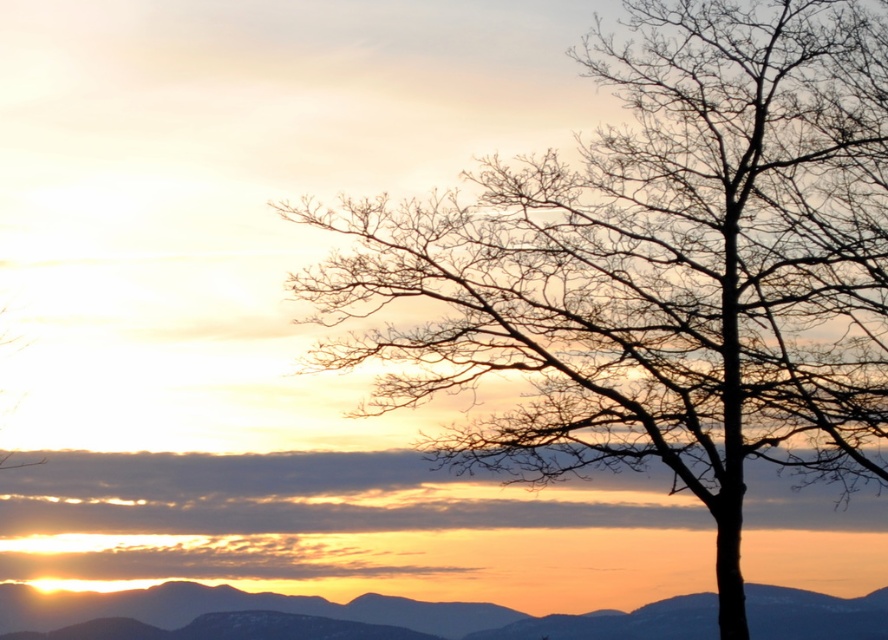
From the picture: Between silhouette bark tree at right and silvery metallic mountain at lower left, which one is positioned lower?

silvery metallic mountain at lower left is below.

Who is more distant from viewer, (624, 355) or (686, 621)?

The point (686, 621) is more distant.

Where is `silhouette bark tree at right`? silhouette bark tree at right is located at coordinates (657, 268).